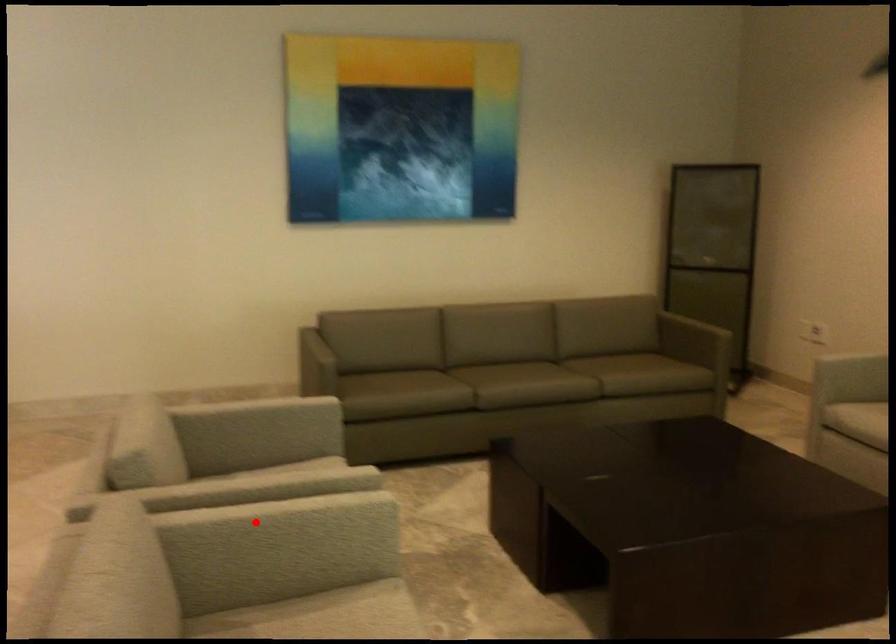
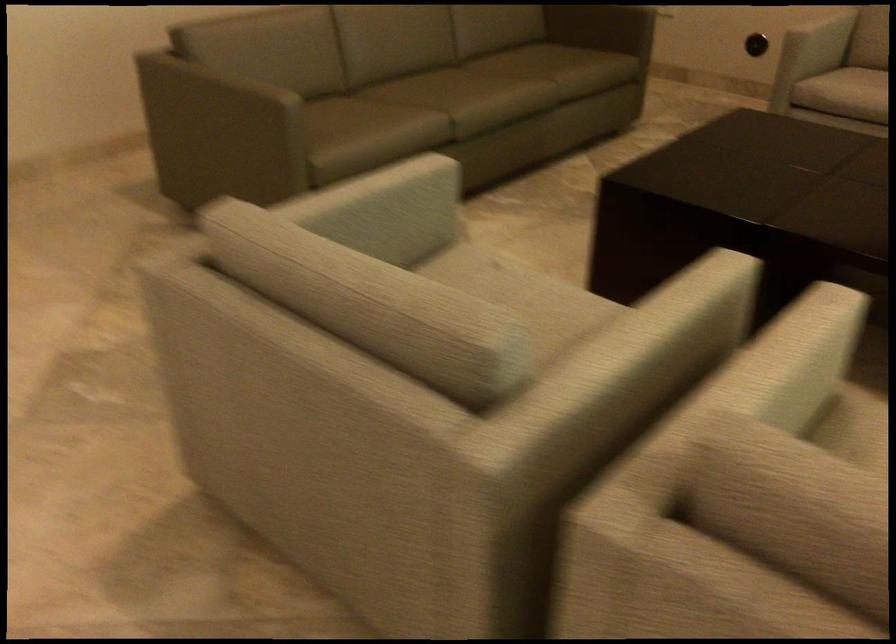
Question: I am providing you with two images of the same scene from different viewpoints. In image1, a red point is highlighted. Considering the same 3D point in image2, which of the following is correct?

Choices:
 (A) It is closer
 (B) It is farther

Answer: (A)